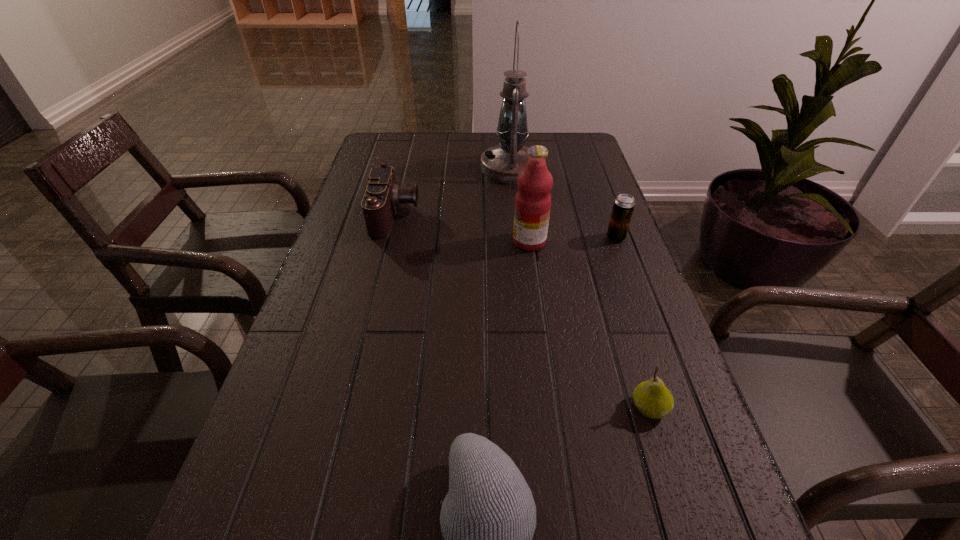
At what (x,y) coordinates should I click in order to perform the action: click on free space at the far right corner. Please return your answer as a coordinate pair (x, y). Looking at the image, I should click on (586, 168).

Image resolution: width=960 pixels, height=540 pixels. Identify the location of free space between the leftmost object and the beer can. (506, 226).

Find the location of a particular element. empty space that is in between the pear and the beer can is located at coordinates (633, 322).

Identify the location of vacant region between the pear and the oil lamp. Image resolution: width=960 pixels, height=540 pixels. (580, 288).

Locate an element on the screen. vacant area that lies between the beer can and the tallest object is located at coordinates (564, 203).

Image resolution: width=960 pixels, height=540 pixels. In order to click on object identified as the third closest to the camera in this screenshot , I will do `click(624, 204)`.

Identify the location of object that is the second closest to the second tallest object. (502, 163).

This screenshot has width=960, height=540. Identify the location of free space in the image that satisfies the following two spatial constraints: 1. on the back side of the beer can; 2. on the front-facing side of the leftmost object. (608, 215).

Locate an element on the screen. This screenshot has width=960, height=540. free space that satisfies the following two spatial constraints: 1. on the front-facing side of the leftmost object; 2. on the right side of the second nearest object is located at coordinates (349, 408).

The width and height of the screenshot is (960, 540). Identify the location of vacant space that satisfies the following two spatial constraints: 1. on the front-facing side of the camera; 2. on the left side of the beer can. (391, 238).